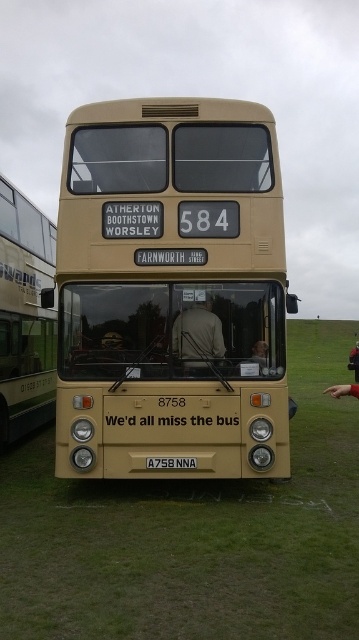
Question: Does light brown leather jacket at center appear over black plastic license plate at center?

Choices:
 (A) yes
 (B) no

Answer: (A)

Question: Which is nearer to the beige matte bus at left?

Choices:
 (A) black plastic license plate at center
 (B) green grass at center

Answer: (B)

Question: Does green grass at center have a larger size compared to black plastic license plate at center?

Choices:
 (A) no
 (B) yes

Answer: (B)

Question: Does matte gold bus at center lie behind light brown leather jacket at center?

Choices:
 (A) yes
 (B) no

Answer: (B)

Question: Among these objects, which one is farthest from the camera?

Choices:
 (A) matte gold bus at center
 (B) green grass at center
 (C) light brown leather jacket at center

Answer: (C)

Question: Which object is the farthest from the beige matte bus at left?

Choices:
 (A) black plastic license plate at center
 (B) light brown leather jacket at center
 (C) green grass at center

Answer: (A)